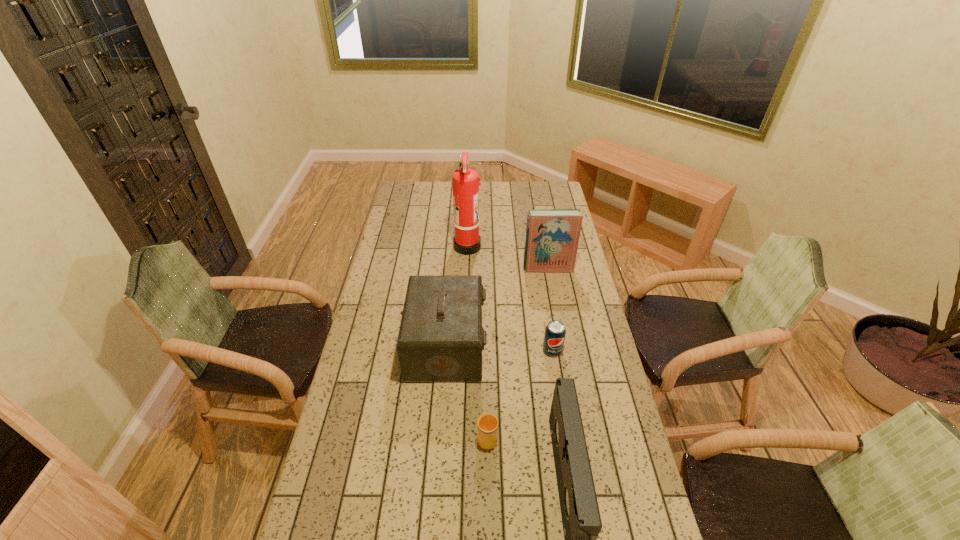
Find the location of a particular element. free point between the first-aid kit and the second tallest object is located at coordinates (497, 307).

I want to click on free space between the fifth tallest object and the shortest object, so click(520, 394).

You are a GUI agent. You are given a task and a screenshot of the screen. Output one action in this format:
    pyautogui.click(x=<x>, y=<y>)
    Task: Click on the vacant space that's between the tallest object and the fifth nearest object
    The image size is (960, 540).
    Given the screenshot: What is the action you would take?
    pyautogui.click(x=508, y=257)

Image resolution: width=960 pixels, height=540 pixels. What are the coordinates of `object that is the fifth nearest to the videotape` in the screenshot? It's located at (466, 241).

This screenshot has height=540, width=960. Find the location of `the second closest object to the first-aid kit`. the second closest object to the first-aid kit is located at coordinates (554, 337).

I want to click on free space that satisfies the following two spatial constraints: 1. at the nozzle of the tallest object; 2. on the side of the cup with the handle, so click(460, 437).